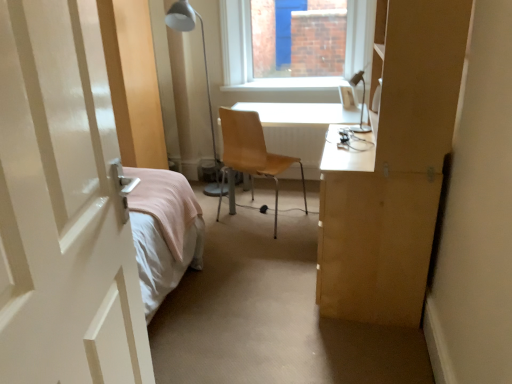
Identify the location of white glossy door at left. The image size is (512, 384). (63, 206).

Where is `light brown wood chair at center`? Image resolution: width=512 pixels, height=384 pixels. light brown wood chair at center is located at coordinates (252, 152).

Based on the photo, looking at their sizes, would you say white metal table lamp at upper center, which appears as the 2th table lamp when viewed from the front, is wider or thinner than metallic silver table lamp at upper right, arranged as the first table lamp when viewed from the front?

white metal table lamp at upper center, which appears as the 2th table lamp when viewed from the front, is wider than metallic silver table lamp at upper right, arranged as the first table lamp when viewed from the front.

From the image's perspective, is white metal table lamp at upper center, the 1th table lamp from the back, located above or below metallic silver table lamp at upper right, arranged as the first table lamp when viewed from the front?

Based on their image positions, white metal table lamp at upper center, the 1th table lamp from the back, is located above metallic silver table lamp at upper right, arranged as the first table lamp when viewed from the front.

In the scene shown: Which of these two, white metal table lamp at upper center, the 2th table lamp positioned from the right, or metallic silver table lamp at upper right, which is the second table lamp in left-to-right order, is smaller?

With smaller size is metallic silver table lamp at upper right, which is the second table lamp in left-to-right order.

I want to click on table lamp on the right of light brown wood chair at center, so click(x=361, y=103).

Is light brown wood chair at center positioned far away from metallic silver table lamp at upper right, which is the second table lamp in left-to-right order?

No, light brown wood chair at center is in close proximity to metallic silver table lamp at upper right, which is the second table lamp in left-to-right order.

Who is shorter, light brown wood chair at center or metallic silver table lamp at upper right, arranged as the first table lamp when viewed from the front?

metallic silver table lamp at upper right, arranged as the first table lamp when viewed from the front.

Can you see light brown wood chair at center touching white glossy door at left?

No, light brown wood chair at center is not touching white glossy door at left.

The height and width of the screenshot is (384, 512). What are the coordinates of `door above the light brown wood chair at center (from a real-world perspective)` in the screenshot? It's located at (63, 206).

In terms of width, does light brown wood chair at center look wider or thinner when compared to white glossy door at left?

light brown wood chair at center is thinner than white glossy door at left.

Between light brown wood chair at center and white glossy door at left, which one has smaller size?

light brown wood chair at center is smaller.

Is metallic silver table lamp at upper right, the 2th table lamp viewed from the back, directly adjacent to white glossy desk at center?

There is a gap between metallic silver table lamp at upper right, the 2th table lamp viewed from the back, and white glossy desk at center.

From a real-world perspective, between metallic silver table lamp at upper right, the 2th table lamp viewed from the back, and white glossy desk at center, who is vertically higher?

metallic silver table lamp at upper right, the 2th table lamp viewed from the back, is physically above.

Which point is more forward, (352,79) or (323,129)?

The point (352,79) is closer.

Is white glossy desk at center located outside white metal table lamp at upper center, the 1th table lamp from the back?

That's correct, white glossy desk at center is outside of white metal table lamp at upper center, the 1th table lamp from the back.

Looking at the image, does white glossy desk at center seem bigger or smaller compared to white metal table lamp at upper center, the 2th table lamp positioned from the right?

Clearly, white glossy desk at center is larger in size than white metal table lamp at upper center, the 2th table lamp positioned from the right.

How many degrees apart are the facing directions of white glossy desk at center and white metal table lamp at upper center, which appears as the 2th table lamp when viewed from the front?

The angle between the facing direction of white glossy desk at center and the facing direction of white metal table lamp at upper center, which appears as the 2th table lamp when viewed from the front, is 0.000297 degrees.

Is white glossy desk at center with white metal table lamp at upper center, the first table lamp in the left-to-right sequence?

No, white glossy desk at center is not making contact with white metal table lamp at upper center, the first table lamp in the left-to-right sequence.

Is metallic silver table lamp at upper right, arranged as the 1th table lamp when viewed from the right, oriented towards light brown wood chair at center?

No, metallic silver table lamp at upper right, arranged as the 1th table lamp when viewed from the right, is not oriented towards light brown wood chair at center.

In terms of size, does metallic silver table lamp at upper right, arranged as the 1th table lamp when viewed from the right, appear bigger or smaller than light brown wood chair at center?

metallic silver table lamp at upper right, arranged as the 1th table lamp when viewed from the right, is smaller than light brown wood chair at center.

Do you think white glossy desk at center is within white glossy door at left, or outside of it?

The correct answer is: outside.

Considering the positions of objects white glossy desk at center and white glossy door at left in the image provided, who is more to the left, white glossy desk at center or white glossy door at left?

white glossy door at left is more to the left.

From a real-world perspective, which object stands above the other?

white glossy door at left.

Locate an element on the screen. This screenshot has height=384, width=512. table lamp above the metallic silver table lamp at upper right, arranged as the first table lamp when viewed from the front (from the image's perspective) is located at coordinates (205, 77).

Identify the location of chair lying on the left of metallic silver table lamp at upper right, arranged as the first table lamp when viewed from the front. The width and height of the screenshot is (512, 384). (252, 152).

From the image, which object appears to be nearer to white metal table lamp at upper center, the first table lamp in the left-to-right sequence, white glossy door at left or metallic silver table lamp at upper right, the 2th table lamp viewed from the back?

The object closer to white metal table lamp at upper center, the first table lamp in the left-to-right sequence, is metallic silver table lamp at upper right, the 2th table lamp viewed from the back.

Considering their positions, is metallic silver table lamp at upper right, the 2th table lamp viewed from the back, positioned closer to white glossy door at left than white glossy desk at center?

metallic silver table lamp at upper right, the 2th table lamp viewed from the back, is positioned closer to the anchor white glossy door at left.

Estimate the real-world distances between objects in this image. Which object is closer to white glossy door at left, metallic silver table lamp at upper right, arranged as the 1th table lamp when viewed from the right, or white metal table lamp at upper center, the 1th table lamp from the back?

metallic silver table lamp at upper right, arranged as the 1th table lamp when viewed from the right.

Which object lies nearer to the anchor point white metal table lamp at upper center, the 1th table lamp from the back, white glossy desk at center or metallic silver table lamp at upper right, the 2th table lamp viewed from the back?

Based on the image, white glossy desk at center appears to be nearer to white metal table lamp at upper center, the 1th table lamp from the back.

Considering their positions, is white glossy door at left positioned further to metallic silver table lamp at upper right, arranged as the 1th table lamp when viewed from the right, than white glossy desk at center?

white glossy door at left lies further to metallic silver table lamp at upper right, arranged as the 1th table lamp when viewed from the right, than the other object.

Looking at the image, which one is located closer to white glossy desk at center, light brown wood chair at center or metallic silver table lamp at upper right, which is the second table lamp in left-to-right order?

light brown wood chair at center is positioned closer to the anchor white glossy desk at center.

Based on their spatial positions, is metallic silver table lamp at upper right, which is the second table lamp in left-to-right order, or white glossy desk at center further from light brown wood chair at center?

The object further to light brown wood chair at center is metallic silver table lamp at upper right, which is the second table lamp in left-to-right order.

Which object lies further to the anchor point white glossy door at left, metallic silver table lamp at upper right, arranged as the 1th table lamp when viewed from the right, or light brown wood chair at center?

light brown wood chair at center.

Where is `chair between white glossy door at left and white metal table lamp at upper center, the 1th table lamp from the back, along the z-axis`? The height and width of the screenshot is (384, 512). chair between white glossy door at left and white metal table lamp at upper center, the 1th table lamp from the back, along the z-axis is located at coordinates (252, 152).

The height and width of the screenshot is (384, 512). Find the location of `table lamp between white glossy door at left and metallic silver table lamp at upper right, the 2th table lamp viewed from the back, in the horizontal direction`. table lamp between white glossy door at left and metallic silver table lamp at upper right, the 2th table lamp viewed from the back, in the horizontal direction is located at coordinates (205, 77).

Locate an element on the screen. table between white metal table lamp at upper center, which appears as the 2th table lamp when viewed from the front, and metallic silver table lamp at upper right, arranged as the 1th table lamp when viewed from the right, in the horizontal direction is located at coordinates (300, 128).

The image size is (512, 384). Find the location of `chair between white metal table lamp at upper center, the first table lamp in the left-to-right sequence, and metallic silver table lamp at upper right, arranged as the 1th table lamp when viewed from the right, from left to right`. chair between white metal table lamp at upper center, the first table lamp in the left-to-right sequence, and metallic silver table lamp at upper right, arranged as the 1th table lamp when viewed from the right, from left to right is located at coordinates (252, 152).